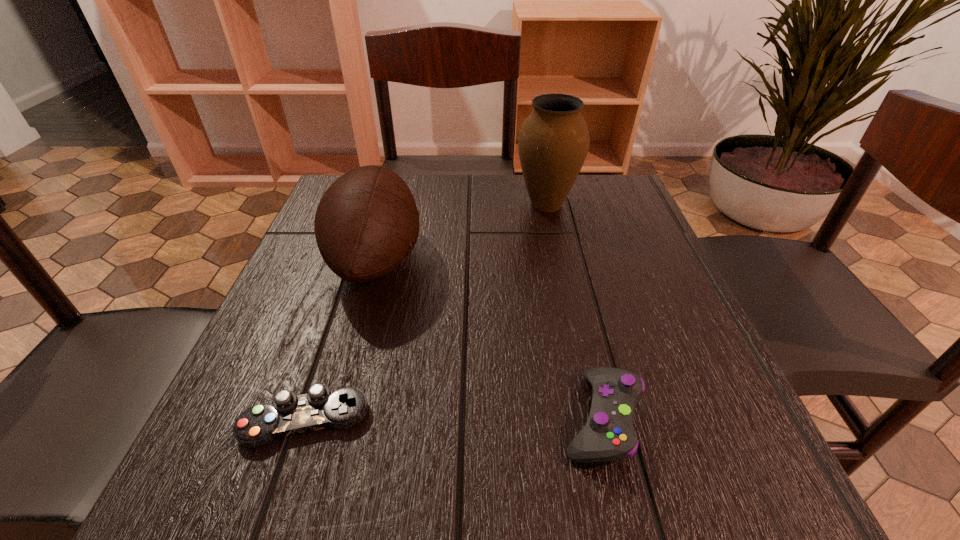
This screenshot has width=960, height=540. What are the coordinates of `vacant area that satisfies the following two spatial constraints: 1. on the back side of the right control; 2. on the right side of the shorter control` in the screenshot? It's located at (306, 418).